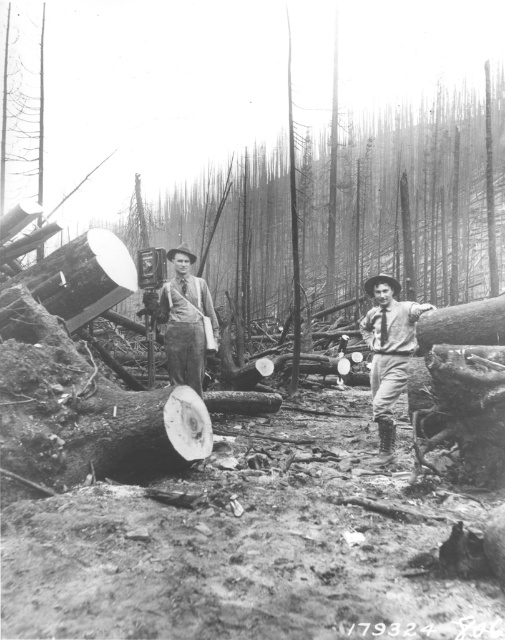
Which is below, rugged denim pants at center or smooth gray shirt at center?

rugged denim pants at center is lower down.

Can you confirm if rugged denim pants at center is positioned above smooth gray shirt at center?

No.

Between point (378, 336) and point (202, 387), which one is positioned in front?

Point (378, 336)

Locate an element on the screen. This screenshot has width=505, height=640. rugged denim pants at center is located at coordinates (388, 352).